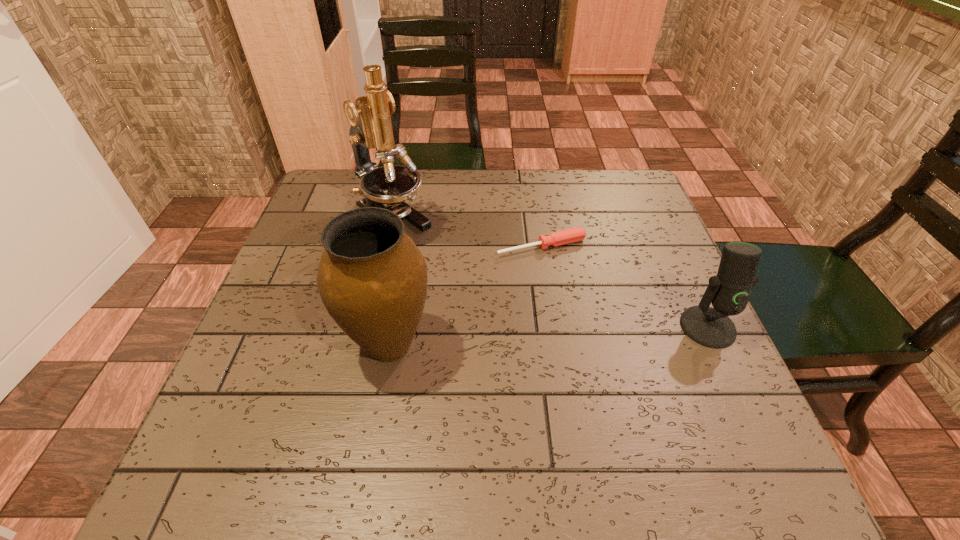
Locate an element on the screen. Image resolution: width=960 pixels, height=540 pixels. the second tallest object is located at coordinates (372, 279).

Identify the location of the rightmost object. This screenshot has height=540, width=960. (728, 291).

Identify the location of microphone. (728, 291).

Where is `microscope`? This screenshot has height=540, width=960. microscope is located at coordinates (387, 187).

You are a GUI agent. You are given a task and a screenshot of the screen. Output one action in this format:
    pyautogui.click(x=<x>, y=<y>)
    Task: Click on the second object from right to left
    This screenshot has width=960, height=540.
    Given the screenshot: What is the action you would take?
    pyautogui.click(x=572, y=235)

Locate an element on the screen. This screenshot has width=960, height=540. screwdriver is located at coordinates click(572, 235).

This screenshot has width=960, height=540. Find the location of `free location located 0.080m on the left of the urn`. free location located 0.080m on the left of the urn is located at coordinates (301, 345).

Locate an element on the screen. This screenshot has height=540, width=960. vacant space situated 0.130m on the front of the rightmost object is located at coordinates (747, 411).

Locate an element on the screen. The width and height of the screenshot is (960, 540). free space located at the eyepiece of the microscope is located at coordinates (509, 316).

Identify the location of vacant space situated at the eyepiece of the microscope. (448, 269).